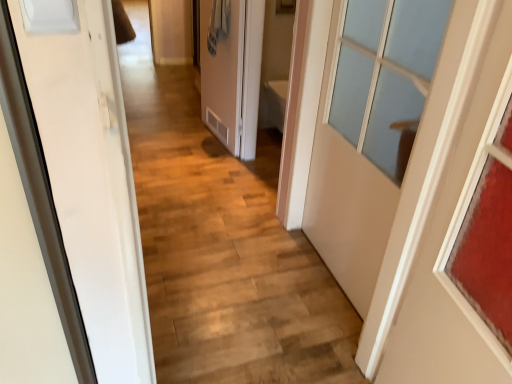
Question: From the image's perspective, is white matte door at right, which ranks as the second door in right-to-left order, positioned above or below matte glass door at right, which is the third door in left-to-right order?

Choices:
 (A) below
 (B) above

Answer: (B)

Question: From a real-world perspective, relative to matte glass door at right, which is the third door in left-to-right order, is white matte door at right, which is the second door in front-to-back order, vertically above or below?

Choices:
 (A) below
 (B) above

Answer: (A)

Question: Estimate the real-world distances between objects in this image. Which object is farther from the white matte door at right, which ranks as the second door in right-to-left order?

Choices:
 (A) matte glass door at right, which appears as the 1th door when viewed from the front
 (B) matte white door at center, which is counted as the first door, starting from the back

Answer: (B)

Question: Considering the real-world distances, which object is farthest from the matte white door at center, which appears as the 1th door when viewed from the left?

Choices:
 (A) white matte door at right, positioned as the second door in back-to-front order
 (B) matte glass door at right, the 1th door positioned from the right

Answer: (B)